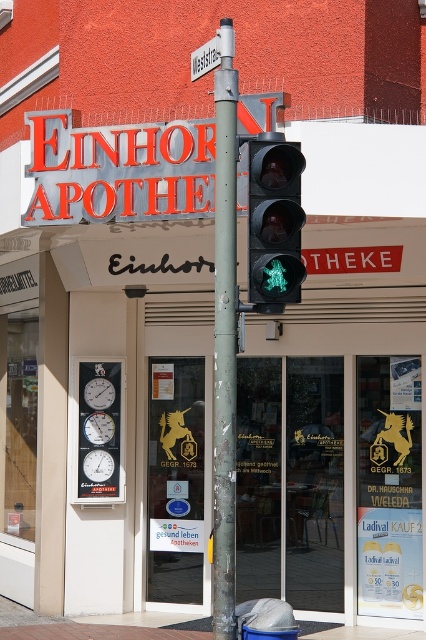
Question: Is the position of green metallic pole at center less distant than that of white plastic street sign at upper center?

Choices:
 (A) no
 (B) yes

Answer: (B)

Question: Can you confirm if metallic orange sign at upper center is positioned to the left of black glass pedestrian signal at center?

Choices:
 (A) no
 (B) yes

Answer: (B)

Question: Which of the following is the farthest from the observer?

Choices:
 (A) black glass pedestrian signal at center
 (B) green metallic pole at center
 (C) white plastic street sign at upper center

Answer: (C)

Question: Which of these objects is positioned farthest from the white plastic clocks at left?

Choices:
 (A) black glass pedestrian signal at center
 (B) white plastic street sign at upper center
 (C) metallic orange sign at upper center
 (D) green metallic pole at center

Answer: (A)

Question: Estimate the real-world distances between objects in this image. Which object is farther from the metallic orange sign at upper center?

Choices:
 (A) green metallic pole at center
 (B) white plastic clocks at left
 (C) white plastic street sign at upper center

Answer: (A)

Question: Can you confirm if metallic orange sign at upper center is smaller than white plastic street sign at upper center?

Choices:
 (A) yes
 (B) no

Answer: (B)